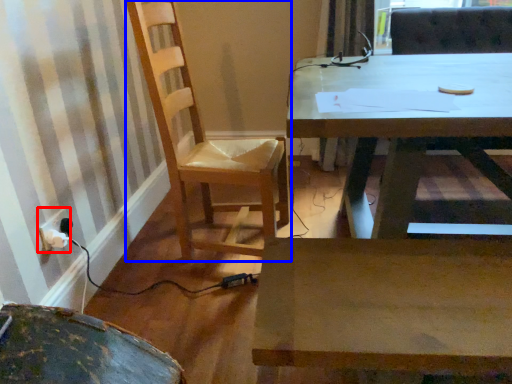
Question: Which object appears farthest to the camera in this image, electric outlet (highlighted by a red box) or chair (highlighted by a blue box)?

Choices:
 (A) electric outlet
 (B) chair

Answer: (A)